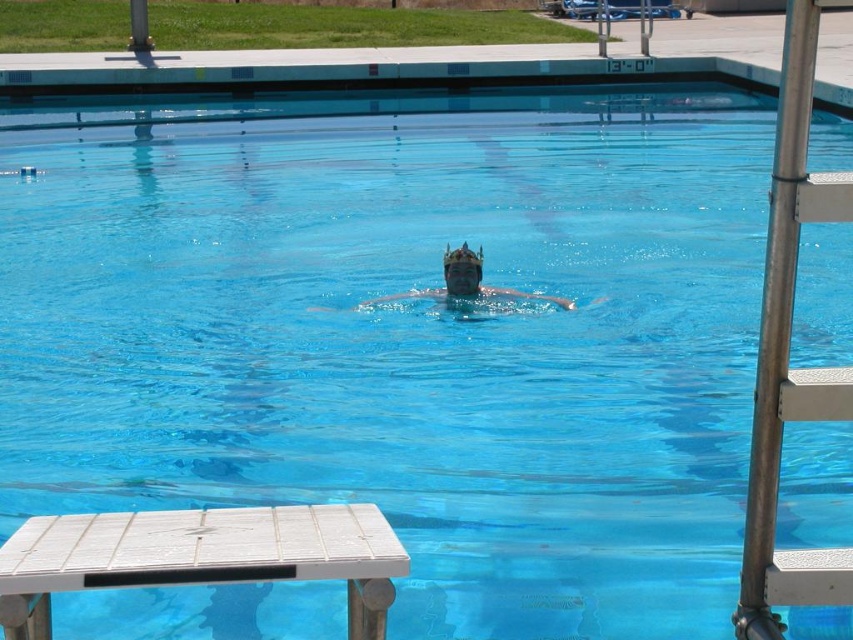
You are standing at the point marked by the coordinates point (483,292) in the image. You want to reach the ladder on the right side of the pool. Given that you can swim at a speed of 2 feet per second, how many seconds will it take you to reach the ladder?

The distance between the point (483,292) and the ladder is 26.23 feet. At a swimming speed of 2 feet per second, it would take 26.23 divided by 2, which equals approximately 13.115 seconds. Rounding to two decimal places, it would take about 13.12 seconds to reach the ladder.

You are standing at the point marked by the coordinates point (200, 556). You want to walk to the ladder on the right side of the pool. Which direction should you go?

The white wood picnic table at lower left is located at point (200, 556). Since the ladder is on the right side of the pool, you should walk towards the right to reach the ladder on the right side of the pool.

Consider the image. You are a guest at a pool party and want to place a transparent plastic crown at center on the white wood picnic table at lower left. Is the crown visible from the pool area?

The white wood picnic table at lower left is below the transparent plastic crown at center, so the crown is already positioned above the table and would be visible from the pool area.